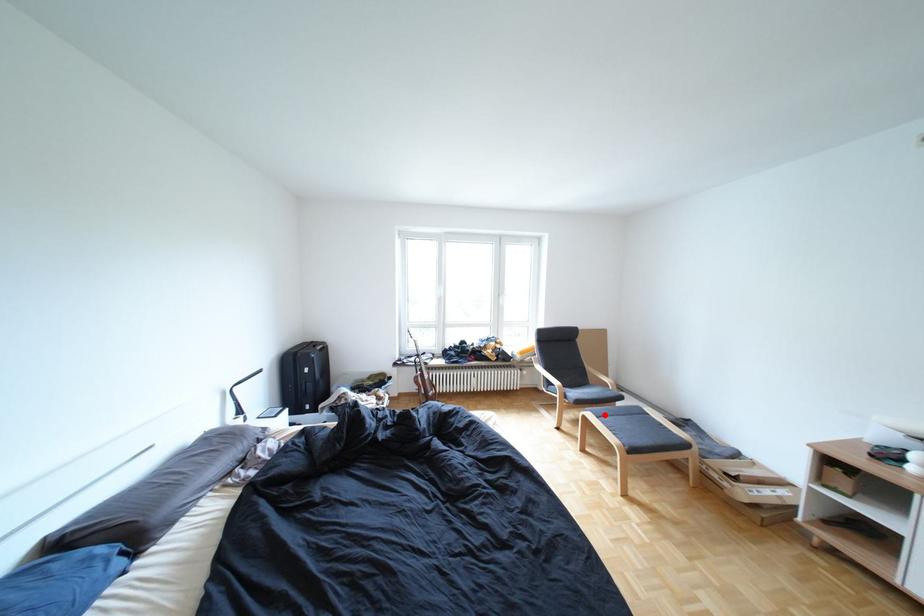
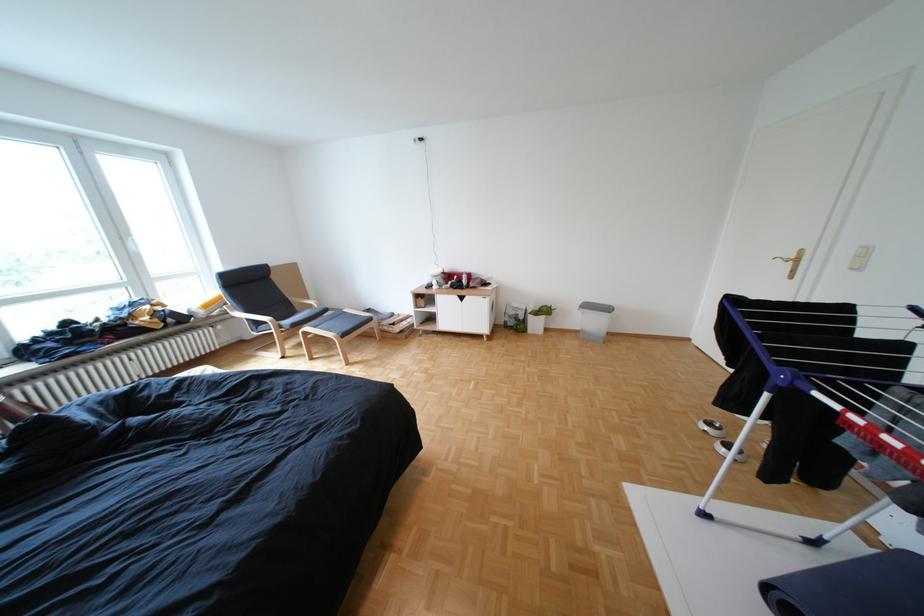
Question: I am providing you with two images of the same scene from different viewpoints. Image1 has a red point marked. In image2, the corresponding 3D location appears at what relative position? Reply with the corresponding letter.

Choices:
 (A) Closer
 (B) Farther

Answer: (A)